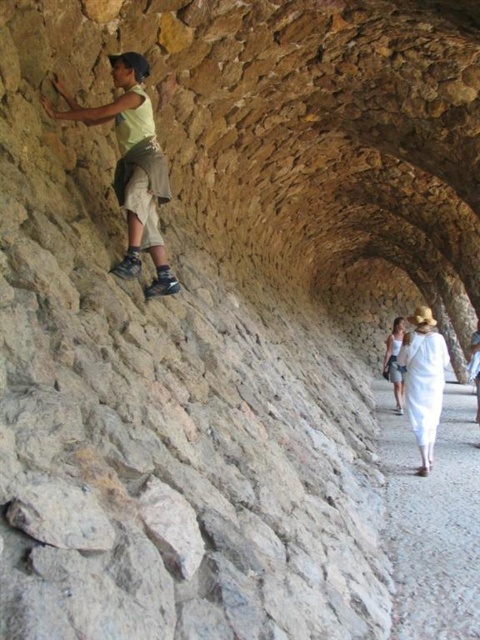
Based on the photo, is matte yellow shirt at upper left wider than white cotton hat at right?

Incorrect, matte yellow shirt at upper left's width does not surpass white cotton hat at right's.

Does point (133, 122) lie in front of point (412, 372)?

Yes, point (133, 122) is closer to viewer.

Locate an element on the screen. The height and width of the screenshot is (640, 480). matte yellow shirt at upper left is located at coordinates (132, 164).

From the picture: Can you confirm if smooth gravel path at lower right is bigger than white cotton hat at right?

No, smooth gravel path at lower right is not bigger than white cotton hat at right.

Between smooth gravel path at lower right and white cotton hat at right, which one appears on the right side from the viewer's perspective?

white cotton hat at right is more to the right.

You are a GUI agent. You are given a task and a screenshot of the screen. Output one action in this format:
    pyautogui.click(x=<x>, y=<y>)
    Task: Click on the smooth gravel path at lower right
    This screenshot has height=640, width=480.
    Given the screenshot: What is the action you would take?
    [x=432, y=520]

Looking at this image, between smooth gravel path at lower right and matte yellow shirt at upper left, which one is positioned higher?

matte yellow shirt at upper left is higher up.

Locate an element on the screen. smooth gravel path at lower right is located at coordinates (432, 520).

Who is more forward, (x=458, y=540) or (x=163, y=172)?

Point (x=458, y=540) is in front.

Identify the location of smooth gravel path at lower right. The width and height of the screenshot is (480, 640). (432, 520).